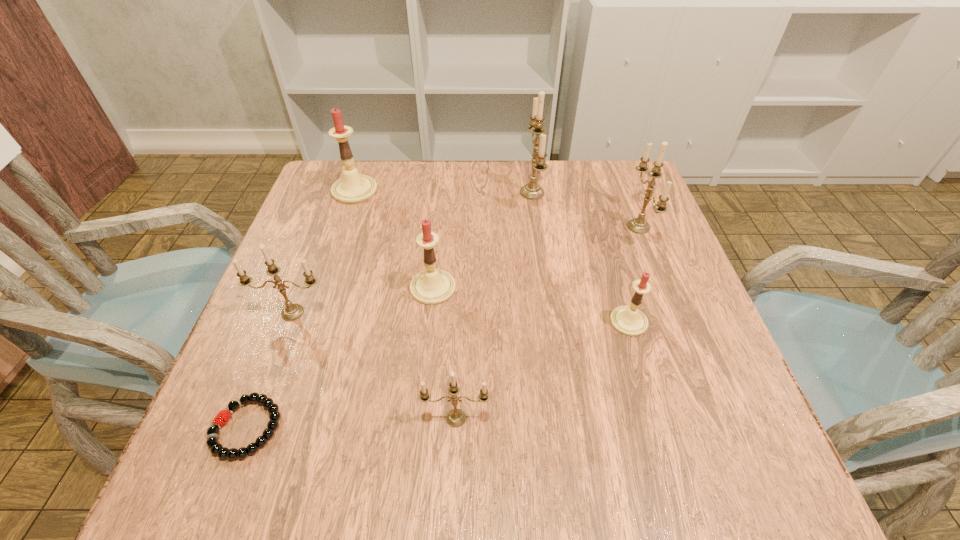
The image size is (960, 540). I want to click on the rightmost red candle, so click(x=629, y=320).

The image size is (960, 540). Identify the location of the second candle from right to left. coord(629,320).

I want to click on the third metallic candle from right to left, so click(456, 417).

I want to click on the smallest metallic candle, so click(456, 417).

Locate an element on the screen. This screenshot has width=960, height=540. bracelet is located at coordinates (222, 417).

Find the location of a particular element. The width and height of the screenshot is (960, 540). the shortest object is located at coordinates (222, 417).

Locate an element on the screen. vacant space located on the left of the tallest candle is located at coordinates (383, 193).

Where is `vacant region located on the right of the farthest red candle`? vacant region located on the right of the farthest red candle is located at coordinates (456, 190).

You are a GUI agent. You are given a task and a screenshot of the screen. Output one action in this format:
    pyautogui.click(x=<x>, y=<y>)
    Task: Click on the free space located 0.110m on the left of the rightmost object
    The height and width of the screenshot is (540, 960).
    Given the screenshot: What is the action you would take?
    click(582, 227)

I want to click on vacant space located 0.170m on the front of the second red candle from left to right, so click(423, 379).